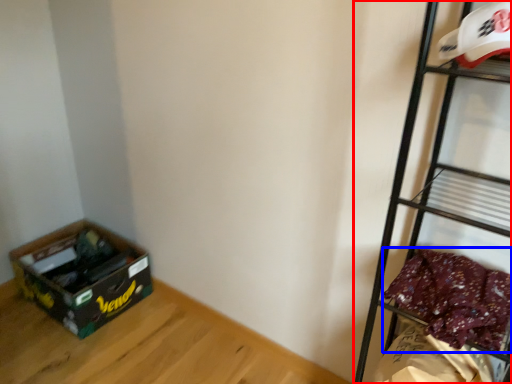
Question: Among these objects, which one is farthest to the camera, shelf (highlighted by a red box) or clothing (highlighted by a blue box)?

Choices:
 (A) shelf
 (B) clothing

Answer: (B)